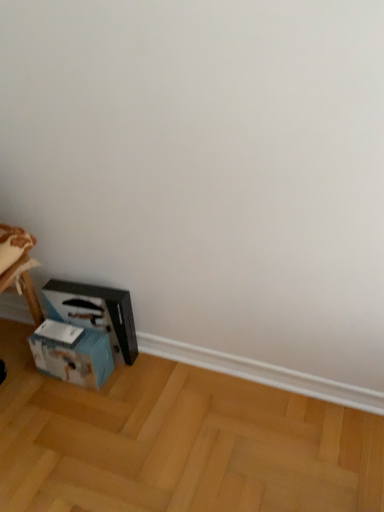
Question: From the image's perspective, is black plastic workbench at lower left on top of blue cardboard box at lower left?

Choices:
 (A) no
 (B) yes

Answer: (B)

Question: Considering the relative sizes of black plastic workbench at lower left and blue cardboard box at lower left in the image provided, is black plastic workbench at lower left bigger than blue cardboard box at lower left?

Choices:
 (A) yes
 (B) no

Answer: (A)

Question: Is black plastic workbench at lower left oriented away from blue cardboard box at lower left?

Choices:
 (A) yes
 (B) no

Answer: (A)

Question: Considering the relative sizes of black plastic workbench at lower left and blue cardboard box at lower left in the image provided, is black plastic workbench at lower left thinner than blue cardboard box at lower left?

Choices:
 (A) no
 (B) yes

Answer: (B)

Question: Is black plastic workbench at lower left located outside blue cardboard box at lower left?

Choices:
 (A) yes
 (B) no

Answer: (A)

Question: Is black plastic workbench at lower left taller or shorter than light brown wooden floor at lower left?

Choices:
 (A) tall
 (B) short

Answer: (A)

Question: Relative to light brown wooden floor at lower left, is black plastic workbench at lower left in front or behind?

Choices:
 (A) front
 (B) behind

Answer: (B)

Question: Would you say black plastic workbench at lower left is inside or outside light brown wooden floor at lower left?

Choices:
 (A) outside
 (B) inside

Answer: (A)

Question: Considering the positions of point (92, 307) and point (251, 501), is point (92, 307) closer or farther from the camera than point (251, 501)?

Choices:
 (A) farther
 (B) closer

Answer: (A)

Question: Looking at their shapes, would you say blue cardboard box at lower left is wider or thinner than light brown wooden floor at lower left?

Choices:
 (A) wide
 (B) thin

Answer: (B)

Question: Considering the relative positions of blue cardboard box at lower left and light brown wooden floor at lower left in the image provided, is blue cardboard box at lower left to the left or to the right of light brown wooden floor at lower left?

Choices:
 (A) right
 (B) left

Answer: (B)

Question: From a real-world perspective, is blue cardboard box at lower left above or below light brown wooden floor at lower left?

Choices:
 (A) below
 (B) above

Answer: (B)

Question: Would you say blue cardboard box at lower left is inside or outside light brown wooden floor at lower left?

Choices:
 (A) inside
 (B) outside

Answer: (B)

Question: Is blue cardboard box at lower left taller or shorter than black plastic workbench at lower left?

Choices:
 (A) tall
 (B) short

Answer: (B)

Question: From a real-world perspective, is blue cardboard box at lower left above or below black plastic workbench at lower left?

Choices:
 (A) below
 (B) above

Answer: (A)